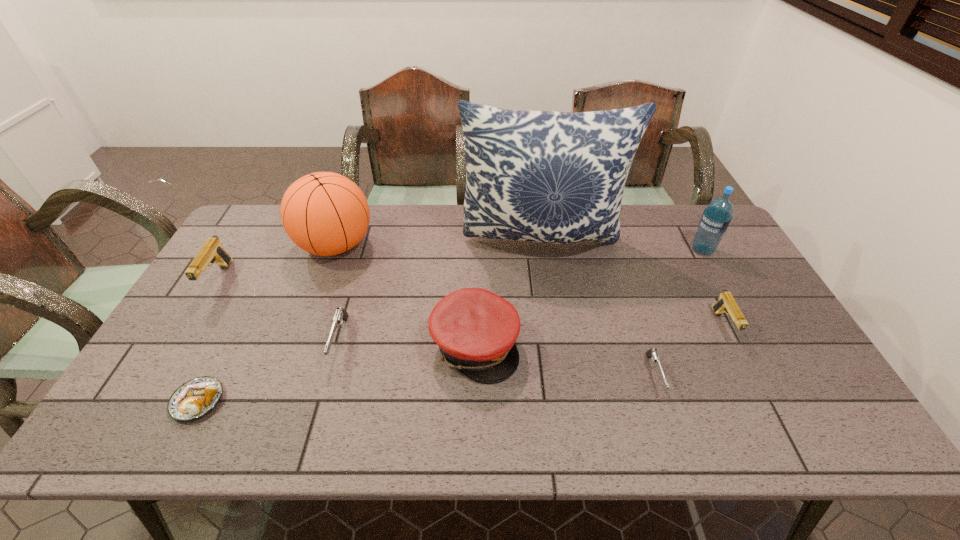
Where is `water bottle located at the right edge`? The width and height of the screenshot is (960, 540). water bottle located at the right edge is located at coordinates (716, 218).

Locate an element on the screen. pistol at the right edge is located at coordinates point(726,303).

You are a GUI agent. You are given a task and a screenshot of the screen. Output one action in this format:
    pyautogui.click(x=<x>, y=<y>)
    Task: Click on the object at the near left corner
    
    Given the screenshot: What is the action you would take?
    pyautogui.click(x=195, y=398)

Where is `object that is at the far right corner`? object that is at the far right corner is located at coordinates (716, 218).

In the image, there is a desktop. Identify the location of vacant area at the far edge. This screenshot has width=960, height=540. (647, 214).

Find the location of a particular element. The height and width of the screenshot is (540, 960). vacant area at the near edge of the desktop is located at coordinates (401, 416).

In the image, there is a desktop. Where is `free region at the left edge`? free region at the left edge is located at coordinates (148, 376).

The image size is (960, 540). Identify the location of vacant position at the right edge of the desktop. (777, 332).

At what (x,y) coordinates should I click in order to perform the action: click on vacant region at the far left corner of the desktop. Please return your answer as a coordinate pair (x, y). Image resolution: width=960 pixels, height=540 pixels. Looking at the image, I should click on (272, 211).

Where is `free space between the pastry and the farthest pistol`? The width and height of the screenshot is (960, 540). free space between the pastry and the farthest pistol is located at coordinates (208, 340).